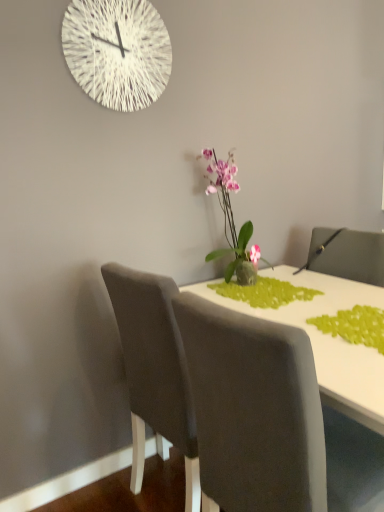
Question: From the image's perspective, is white string clock at upper center located above white glossy table at center?

Choices:
 (A) yes
 (B) no

Answer: (A)

Question: Could you tell me if white string clock at upper center is turned towards white glossy table at center?

Choices:
 (A) yes
 (B) no

Answer: (B)

Question: Considering the relative sizes of white string clock at upper center and white glossy table at center in the image provided, is white string clock at upper center smaller than white glossy table at center?

Choices:
 (A) yes
 (B) no

Answer: (A)

Question: Is white string clock at upper center at the right side of white glossy table at center?

Choices:
 (A) yes
 (B) no

Answer: (B)

Question: From a real-world perspective, is white string clock at upper center positioned over white glossy table at center based on gravity?

Choices:
 (A) yes
 (B) no

Answer: (A)

Question: From the image's perspective, is white string clock at upper center positioned above or below pink glossy orchid at center?

Choices:
 (A) below
 (B) above

Answer: (B)

Question: Is white string clock at upper center spatially inside pink glossy orchid at center, or outside of it?

Choices:
 (A) outside
 (B) inside

Answer: (A)

Question: From a real-world perspective, relative to pink glossy orchid at center, is white string clock at upper center vertically above or below?

Choices:
 (A) below
 (B) above

Answer: (B)

Question: Considering the positions of white string clock at upper center and pink glossy orchid at center in the image, is white string clock at upper center wider or thinner than pink glossy orchid at center?

Choices:
 (A) wide
 (B) thin

Answer: (B)

Question: Is green matte plant at center, acting as the second plant starting from the front, inside the boundaries of green textured placemat at lower right, the second plant from the back, or outside?

Choices:
 (A) inside
 (B) outside

Answer: (B)

Question: From the image's perspective, is green matte plant at center, acting as the second plant starting from the front, located above or below green textured placemat at lower right, which appears as the first plant when viewed from the front?

Choices:
 (A) below
 (B) above

Answer: (B)

Question: Looking at their shapes, would you say green matte plant at center, which appears as the 1th plant when viewed from the back, is wider or thinner than green textured placemat at lower right, which appears as the first plant when viewed from the front?

Choices:
 (A) thin
 (B) wide

Answer: (A)

Question: In the image, is green matte plant at center, acting as the second plant starting from the front, on the left side or the right side of green textured placemat at lower right, the second plant from the back?

Choices:
 (A) left
 (B) right

Answer: (A)

Question: Looking at the image, does pink glossy orchid at center seem bigger or smaller compared to white glossy table at center?

Choices:
 (A) big
 (B) small

Answer: (B)

Question: Considering the positions of pink glossy orchid at center and white glossy table at center in the image, is pink glossy orchid at center taller or shorter than white glossy table at center?

Choices:
 (A) short
 (B) tall

Answer: (A)